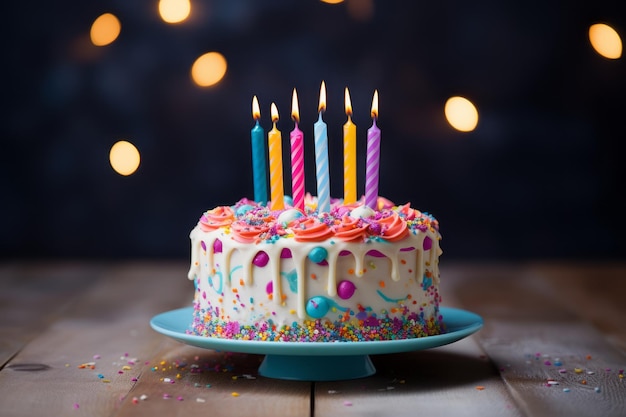
Where is `candle flames`? This screenshot has width=626, height=417. candle flames is located at coordinates (255, 109), (274, 113), (293, 107), (325, 98), (347, 107), (374, 106).